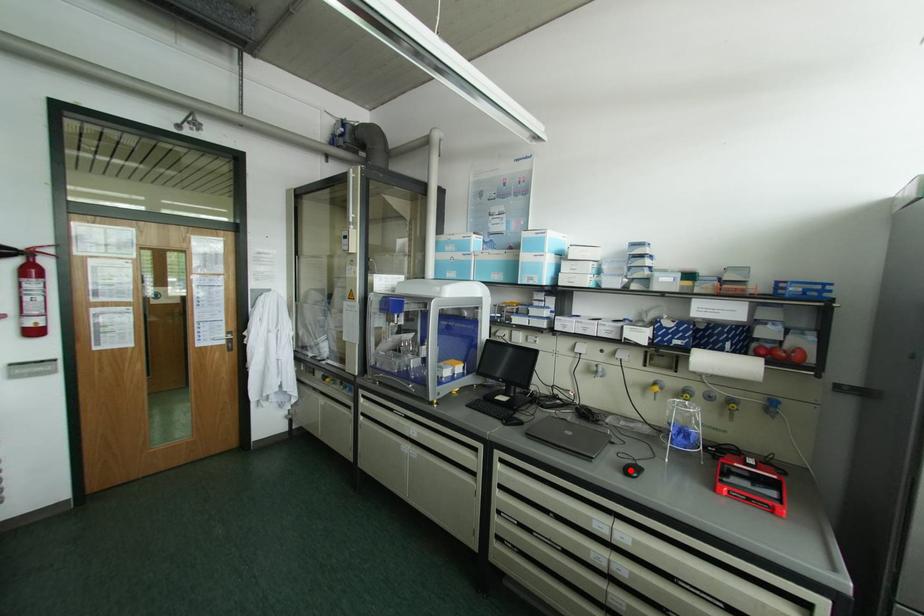
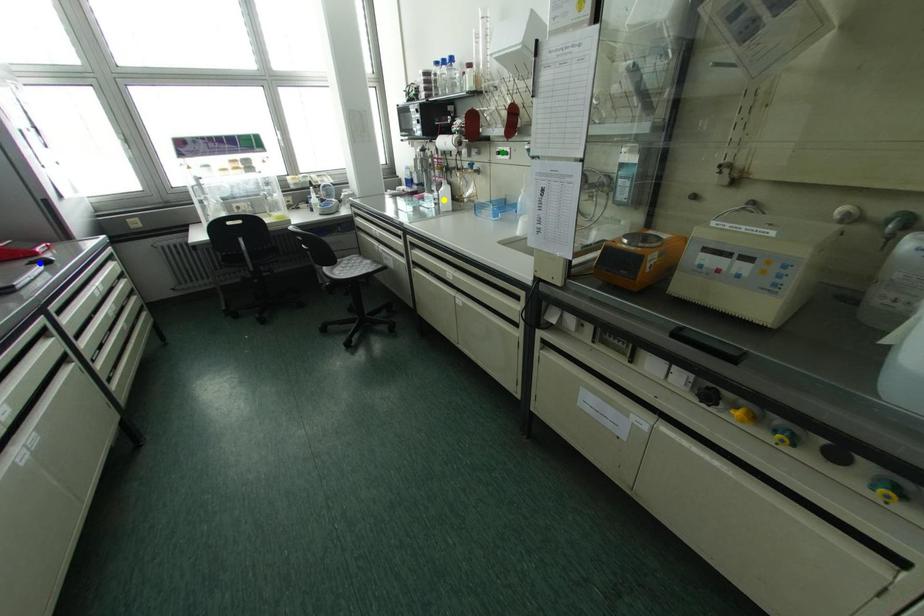
Question: I am providing you with two images of the same scene from different viewpoints. A red point is marked on the first image. You are given multiple points on the second image. Can you choose the point in image 2 that corresponds to the point in image 1?

Choices:
 (A) blue point
 (B) green point
 (C) yellow point

Answer: (A)